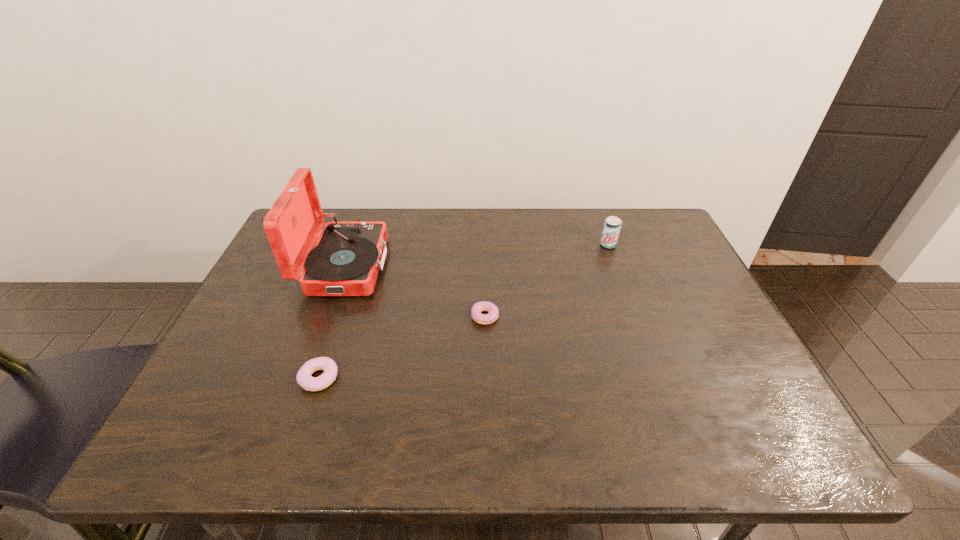
This screenshot has width=960, height=540. In order to click on phonograph_record in this screenshot , I will do `click(345, 261)`.

Locate an element on the screen. The image size is (960, 540). beer can is located at coordinates (612, 226).

At what (x,y) coordinates should I click in order to perform the action: click on the second tallest object. Please return your answer as a coordinate pair (x, y). Looking at the image, I should click on (612, 226).

Where is `the left doughnut`? Image resolution: width=960 pixels, height=540 pixels. the left doughnut is located at coordinates (304, 379).

You are a GUI agent. You are given a task and a screenshot of the screen. Output one action in this format:
    pyautogui.click(x=<x>, y=<y>)
    Task: Click on the nearest object
    The height and width of the screenshot is (540, 960).
    Given the screenshot: What is the action you would take?
    point(304,379)

Identify the location of the second object from right to left. 478,307.

Find the location of a particular element. This screenshot has height=540, width=960. the shortest object is located at coordinates (478, 307).

This screenshot has width=960, height=540. In order to click on vacant region located 0.200m on the front-facing side of the phonograph_record in this screenshot , I will do `click(455, 266)`.

Identify the location of free spot located 0.140m on the front of the beer can. (621, 280).

Identify the location of free space located on the left of the nearest object. (205, 378).